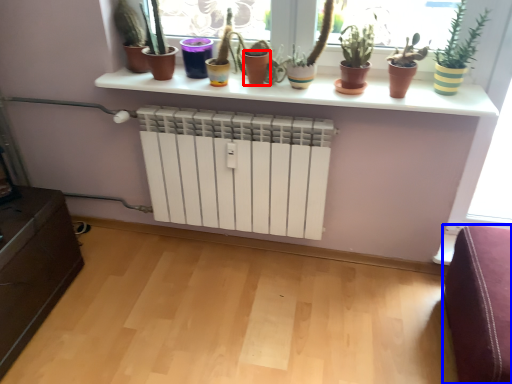
Question: Among these objects, which one is nearest to the camera, vase (highlighted by a red box) or furniture (highlighted by a blue box)?

Choices:
 (A) vase
 (B) furniture

Answer: (B)